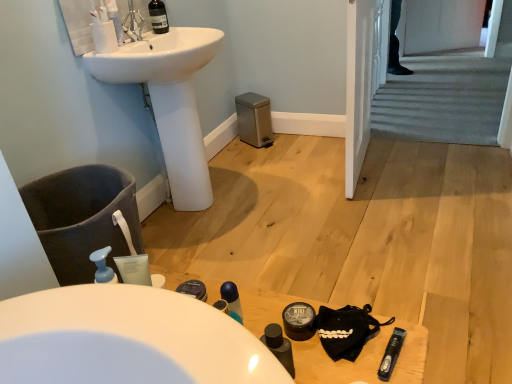
At what (x,y) coordinates should I click in order to perform the action: click on free spot to the left of transparent plastic mouthwash at lower right, placed as the 3th mouthwash when sorted from top to bottom. Please return your answer as a coordinate pair (x, y). The width and height of the screenshot is (512, 384). Looking at the image, I should click on (331, 348).